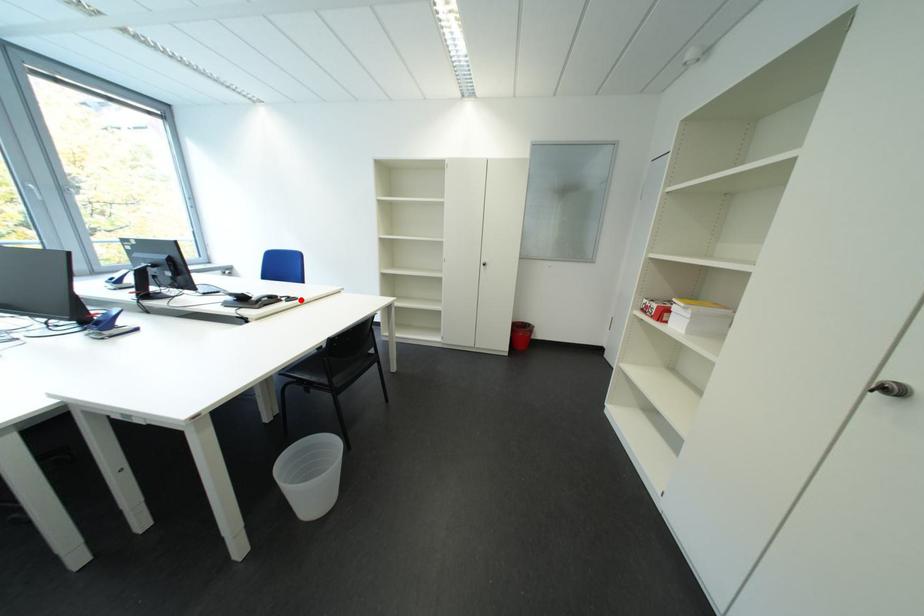
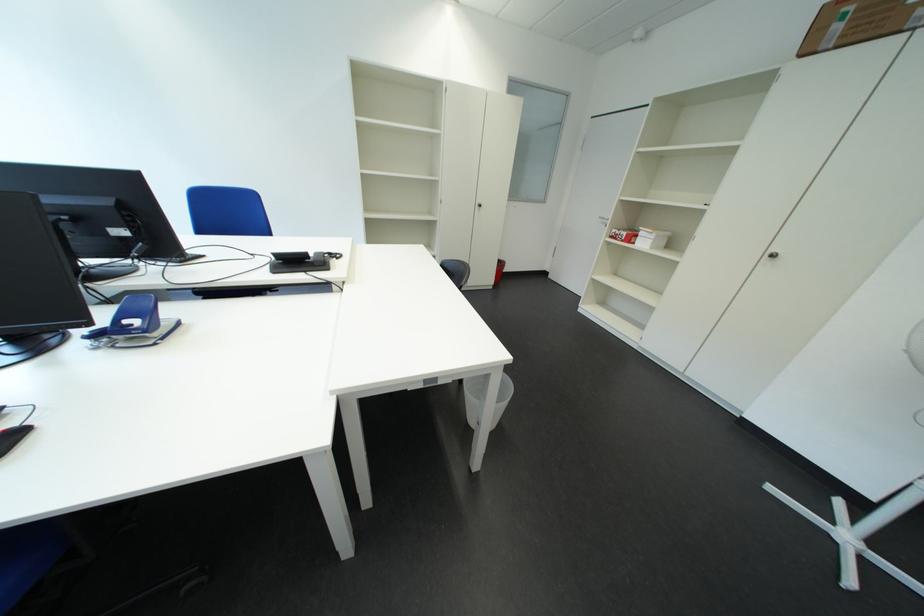
In the second image, find the point that corresponds to the highlighted location in the first image.

(342, 256)